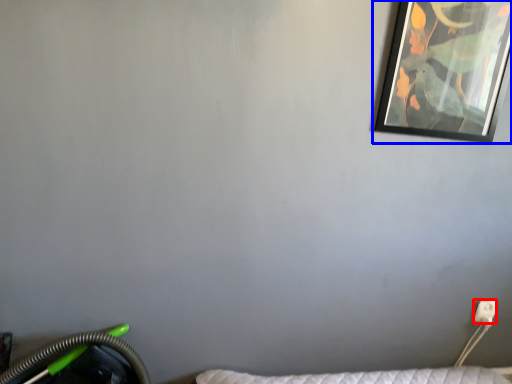
Question: Among these objects, which one is farthest to the camera, electric outlet (highlighted by a red box) or picture frame (highlighted by a blue box)?

Choices:
 (A) electric outlet
 (B) picture frame

Answer: (A)